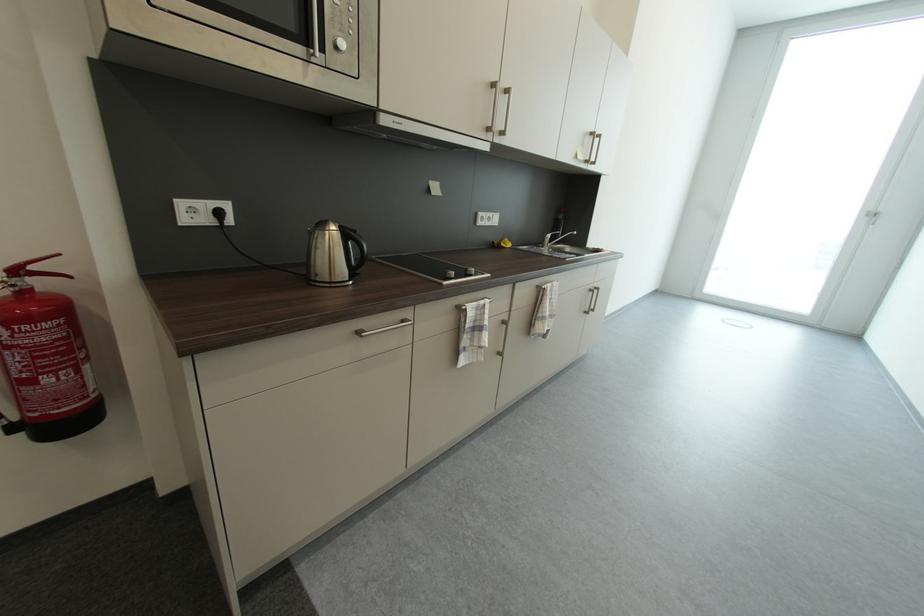
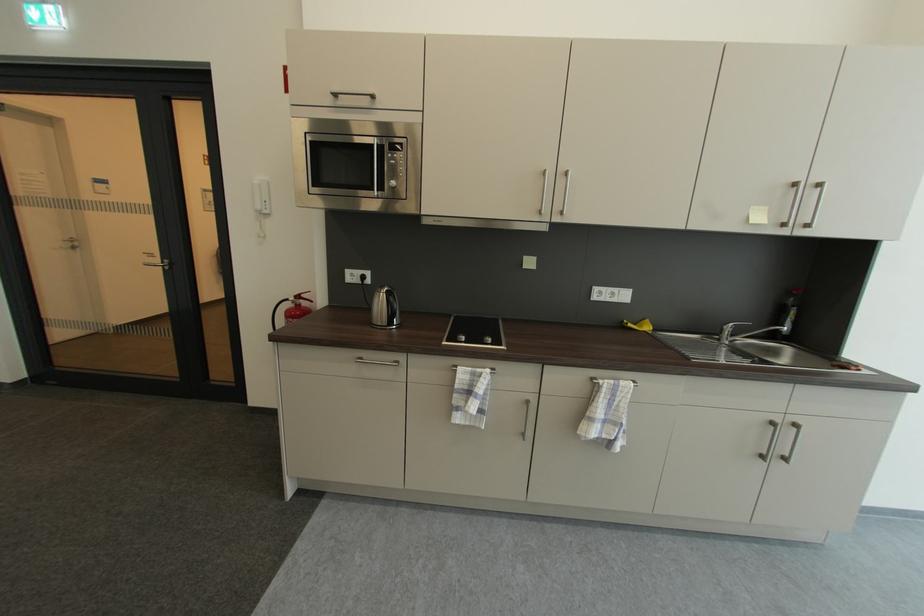
Where in the second image is the point corresponding to the point at 365,333 from the first image?

(367, 360)